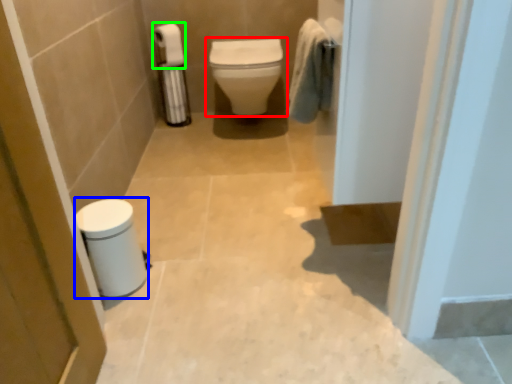
Question: Considering the real-world distances, which object is farthest from toilet (highlighted by a red box)? porcelain (highlighted by a blue box) or toilet paper (highlighted by a green box)?

Choices:
 (A) porcelain
 (B) toilet paper

Answer: (A)